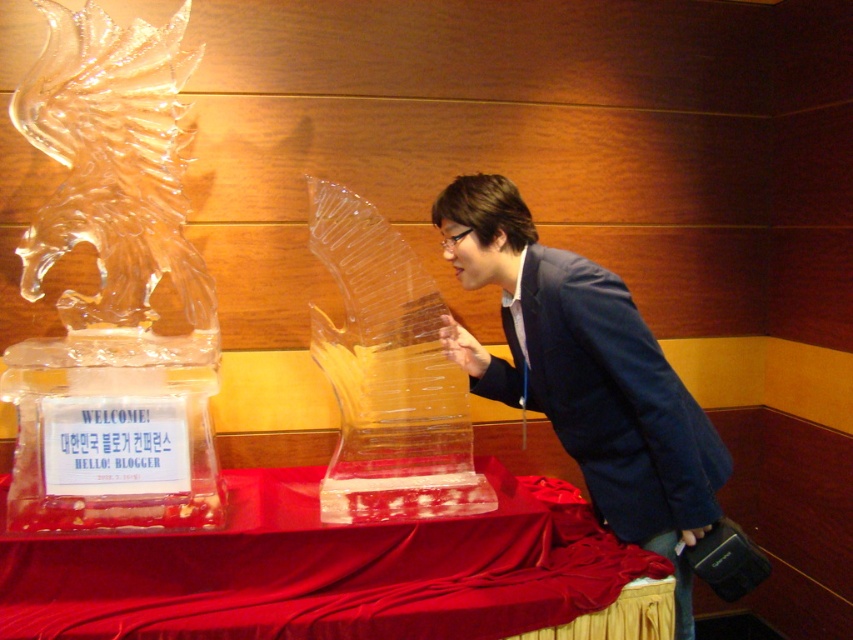
Based on the photo, between blue fabric jacket at center and transparent ice sculpture at center, which one has less height?

transparent ice sculpture at center

Which is in front, point (468, 237) or point (337, 196)?

Point (337, 196) is more forward.

Locate an element on the screen. blue fabric jacket at center is located at coordinates (584, 374).

Which is above, smooth red fabric at center or transparent ice sculpture at center?

Positioned higher is transparent ice sculpture at center.

Between point (592, 552) and point (453, 384), which one is positioned in front?

Point (592, 552) is in front.

The height and width of the screenshot is (640, 853). Identify the location of smooth red fabric at center. (322, 573).

Where is `clear ice sculpture at left`? Image resolution: width=853 pixels, height=640 pixels. clear ice sculpture at left is located at coordinates (112, 291).

Is clear ice sculpture at left taller than blue fabric jacket at center?

Yes.

This screenshot has height=640, width=853. I want to click on clear ice sculpture at left, so click(x=112, y=291).